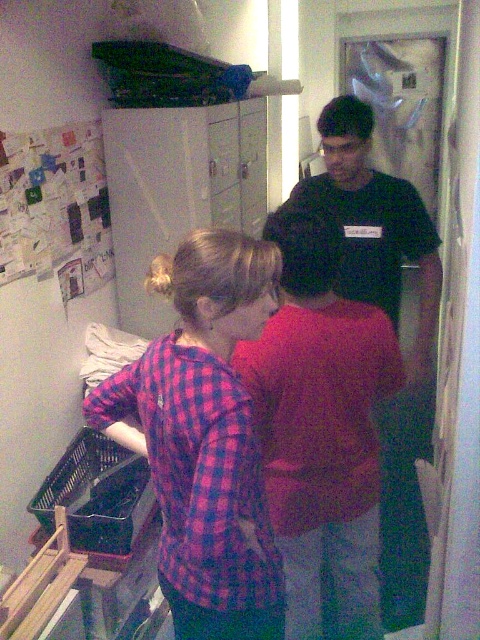
You are a delivery person who needs to place a small package between the matte red shirt at center and the black matte shirt at center. Can you fit it there?

The distance between the matte red shirt at center and the black matte shirt at center is 22.20 inches. Since the package is small, it should fit comfortably in the space between them.

You are organizing a clothing rack and need to arrange the matte red shirt at center and the black matte shirt at center vertically. Which one should you place on the lower shelf if you want the taller item to be on top?

The black matte shirt at center is taller than the matte red shirt at center, so you should place the black matte shirt at center on the top shelf and the matte red shirt at center on the lower shelf.